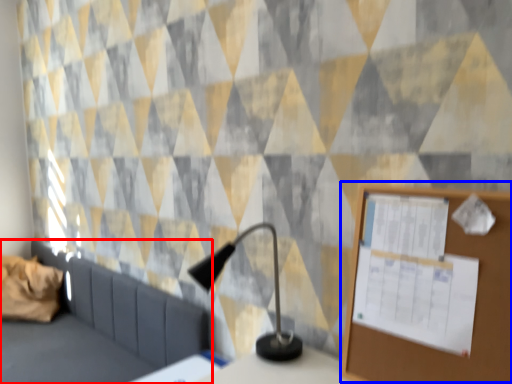
Question: Which object is closer to the camera taking this photo, furniture (highlighted by a red box) or bulletin board (highlighted by a blue box)?

Choices:
 (A) furniture
 (B) bulletin board

Answer: (B)